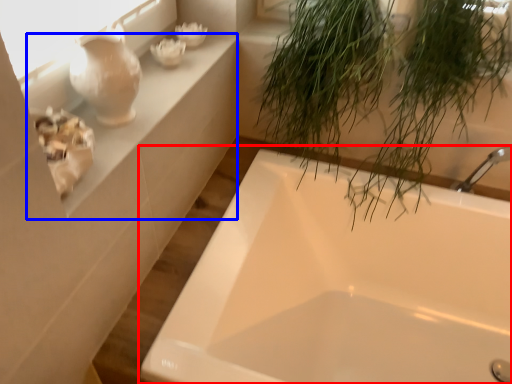
Question: Among these objects, which one is nearest to the camera, bathtub (highlighted by a red box) or window sill (highlighted by a blue box)?

Choices:
 (A) bathtub
 (B) window sill

Answer: (A)